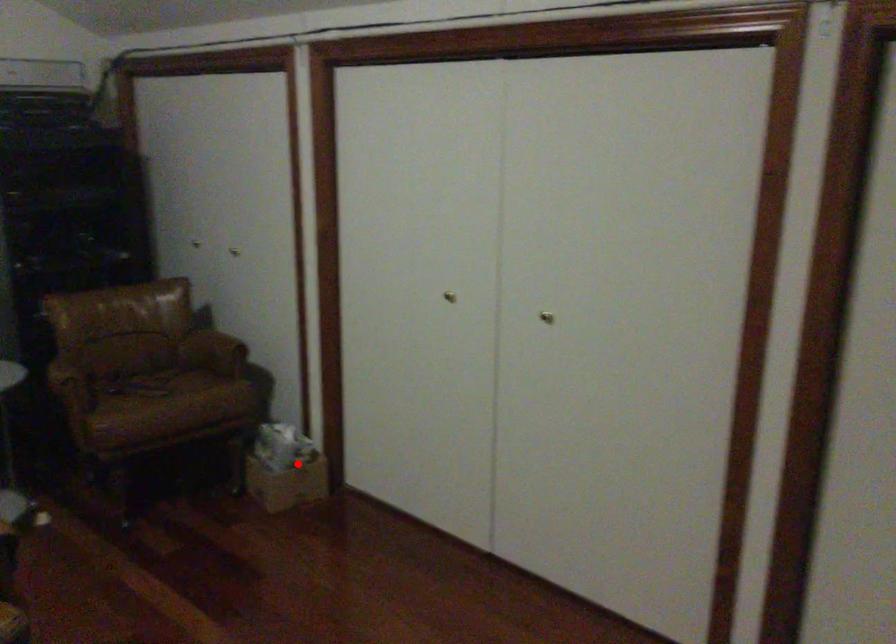
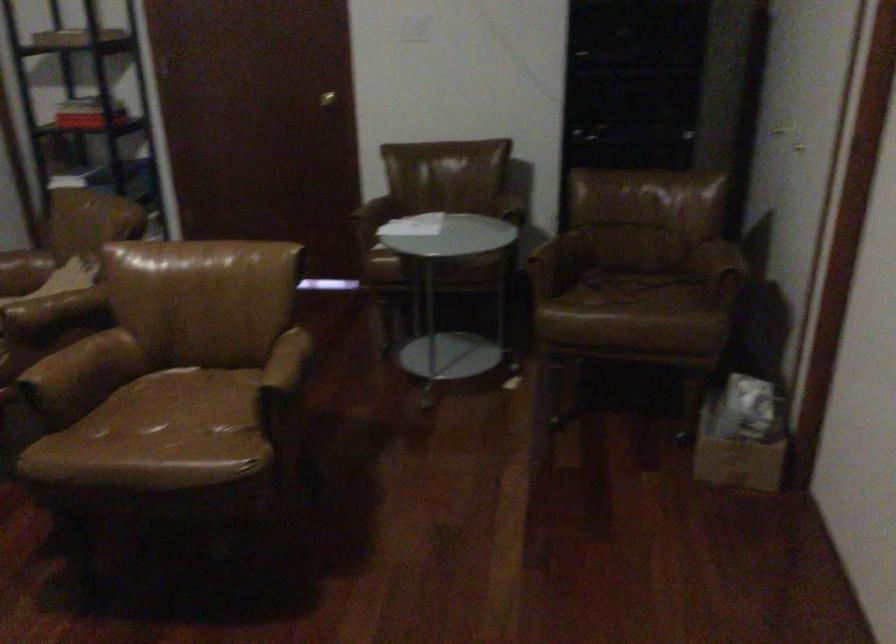
Find the pixel in the second image that matches the highlighted location in the first image.

(742, 436)